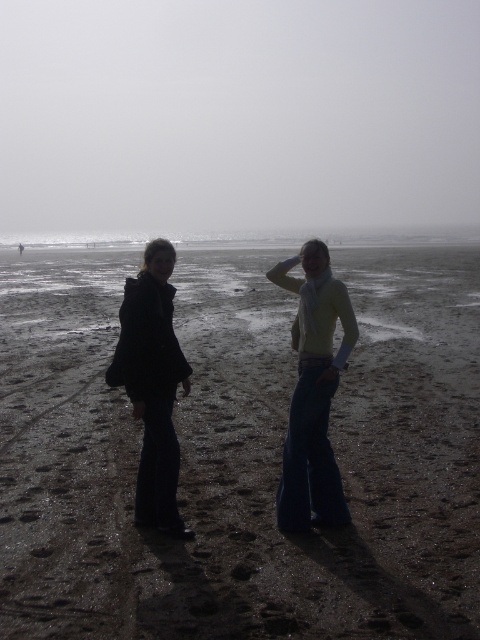
Is point (111, 275) in front of point (290, 502)?

No, it is behind (290, 502).

Which is in front, point (248, 476) or point (312, 294)?

Point (312, 294) is in front.

Identify the location of dark sand at center. (240, 452).

Who is positioned more to the right, dark sand at center or dark blue jeans at center?

From the viewer's perspective, dark sand at center appears more on the right side.

Does dark sand at center have a lesser height compared to dark blue jeans at center?

No, dark sand at center is not shorter than dark blue jeans at center.

Identify the location of dark sand at center. The height and width of the screenshot is (640, 480). (240, 452).

Between dark blue jeans at center and matte black coat at left, which one appears on the left side from the viewer's perspective?

matte black coat at left

Can you confirm if dark blue jeans at center is positioned below matte black coat at left?

Yes.

Identify the location of dark blue jeans at center. (313, 394).

What are the coordinates of `dark blue jeans at center` in the screenshot? It's located at (313, 394).